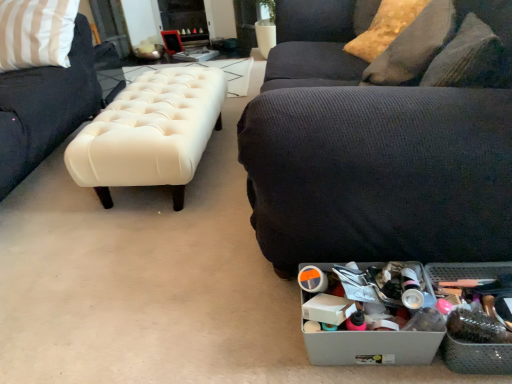
I want to click on vacant area on top of metallic gray storage box at lower right, which is the second storage box in right-to-left order (from a real-world perspective), so click(x=354, y=301).